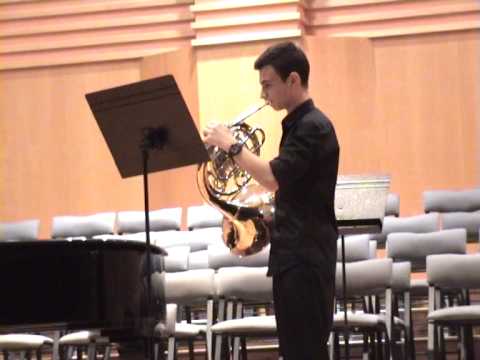
Find the location of `music stand`. music stand is located at coordinates (149, 93).